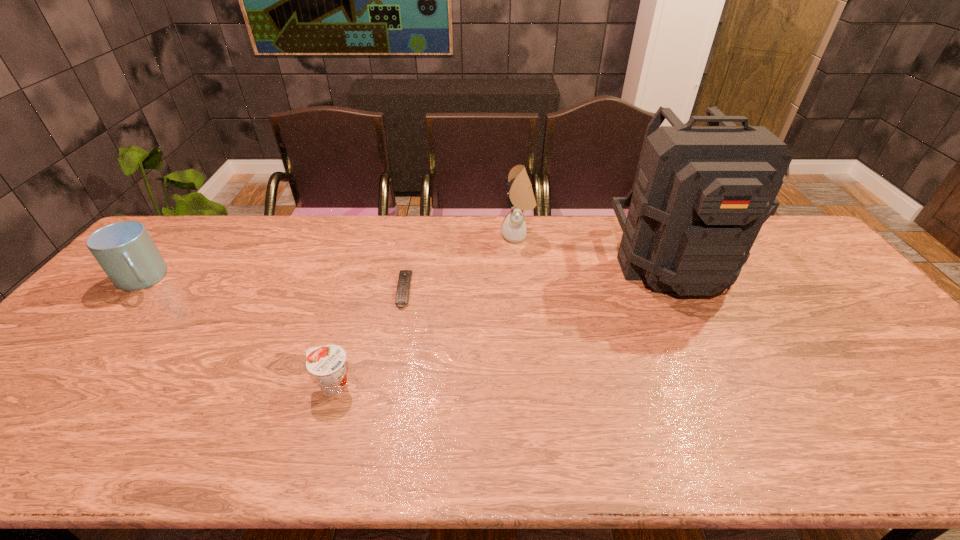
Image resolution: width=960 pixels, height=540 pixels. Identify the location of unoccupied area between the leftmost object and the fourth shortest object. 330,258.

At what (x,y) coordinates should I click in order to perform the action: click on empty space between the doll and the leftmost object. Please return your answer as a coordinate pair (x, y). Looking at the image, I should click on (330, 258).

The width and height of the screenshot is (960, 540). In order to click on free area in between the tallest object and the shortest object in this screenshot , I will do point(538,276).

Where is `unoccupied area between the remote control and the third shortest object`? The height and width of the screenshot is (540, 960). unoccupied area between the remote control and the third shortest object is located at coordinates (274, 285).

Identify the location of empty location between the third shortest object and the shortest object. (274, 285).

Find the location of `object that is the second closest to the leftmost object`. object that is the second closest to the leftmost object is located at coordinates (402, 293).

Image resolution: width=960 pixels, height=540 pixels. In order to click on the second closest object to the fourth shortest object in this screenshot , I will do `click(402, 293)`.